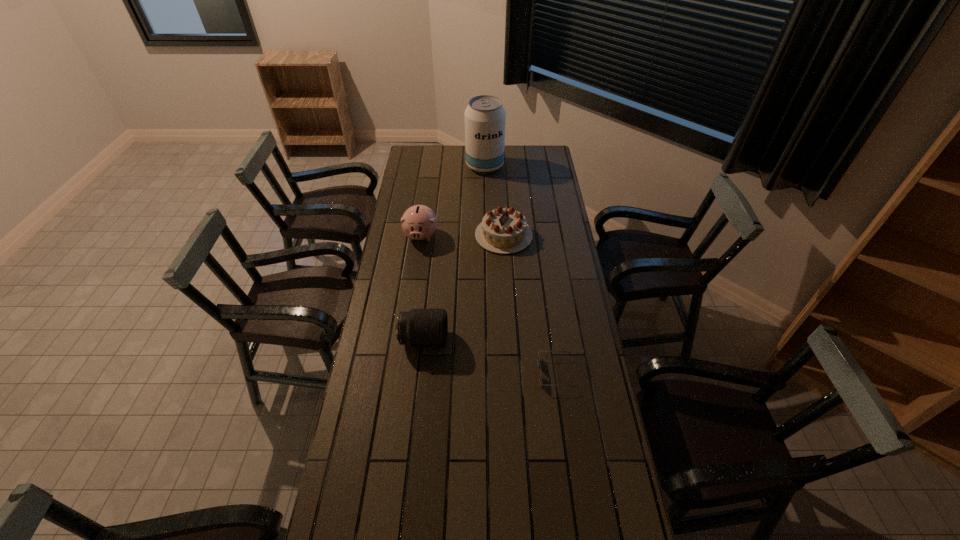
At what (x,y) coordinates should I click in order to perform the action: click on vacant point located between the nearest object and the tallest object. Please return your answer as a coordinate pair (x, y). The image size is (960, 540). Looking at the image, I should click on click(x=520, y=269).

Identify which object is located as the third nearest to the second nearest object. Please provide its 2D coordinates. Your answer should be formatted as a tuple, i.e. [(x, y)], where the tuple contains the x and y coordinates of a point satisfying the conditions above.

[(419, 222)]

The image size is (960, 540). In order to click on object that can be found as the third closest to the alcohol in this screenshot , I will do `click(419, 327)`.